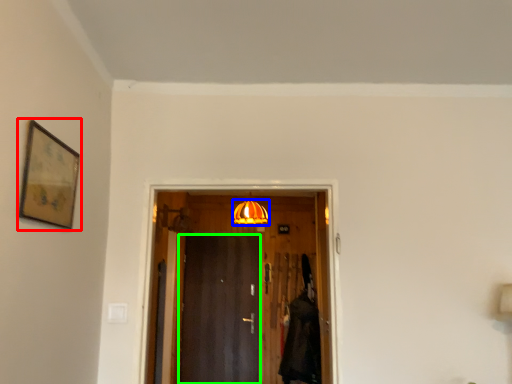
Question: Which object is positioned farthest from picture frame (highlighted by a red box)? Select from lamp (highlighted by a blue box) and door (highlighted by a green box).

Choices:
 (A) lamp
 (B) door

Answer: (A)